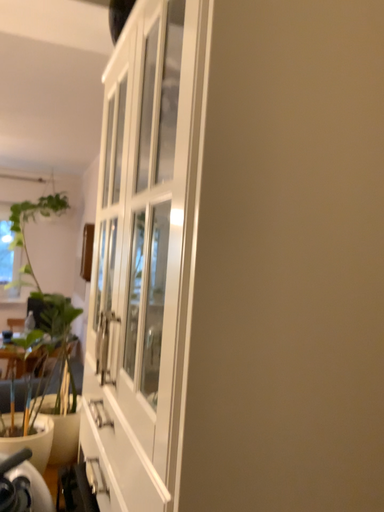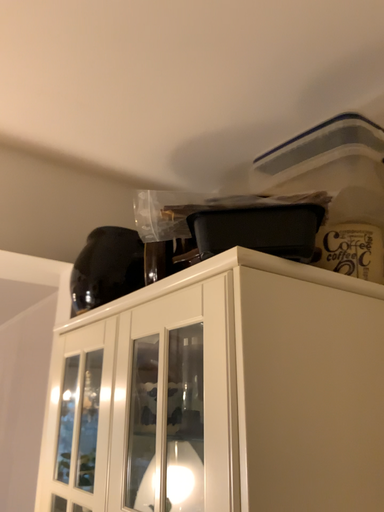
Question: How did the camera likely rotate when shooting the video?

Choices:
 (A) rotated left
 (B) rotated right

Answer: (B)